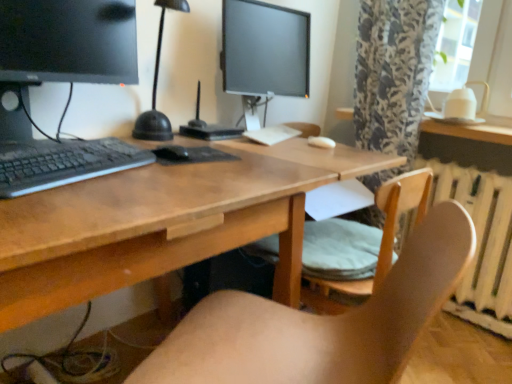
You are a GUI agent. You are given a task and a screenshot of the screen. Output one action in this format:
    pyautogui.click(x=<x>, y=<y>)
    Task: Click on the free space in front of satin black monitor at center
    The image size is (512, 384).
    Given the screenshot: What is the action you would take?
    pyautogui.click(x=219, y=137)